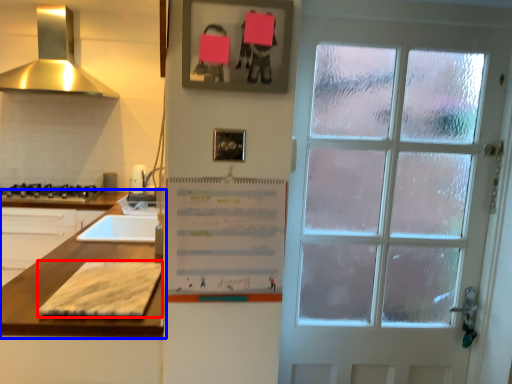
Question: Which object appears farthest to the camera in this image, cardboard (highlighted by a red box) or countertop (highlighted by a blue box)?

Choices:
 (A) cardboard
 (B) countertop

Answer: (B)